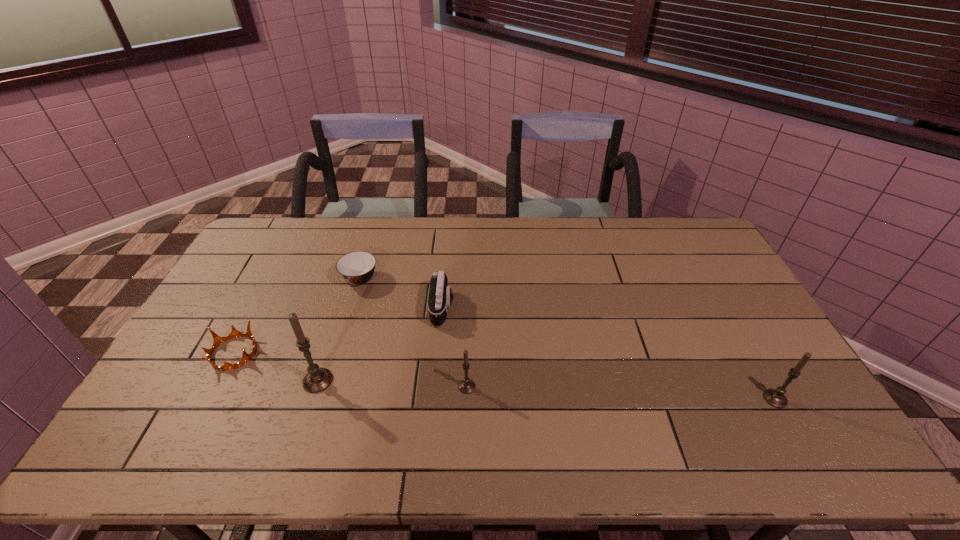
Find the location of a particular element. spot to insert another candle for uniform distribution is located at coordinates (619, 393).